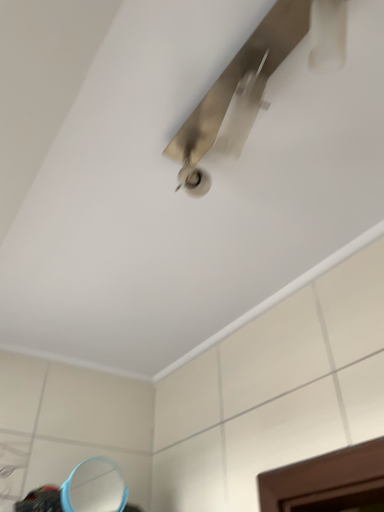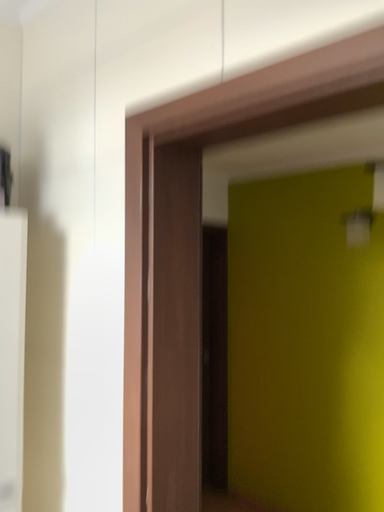
Question: How did the camera likely rotate when shooting the video?

Choices:
 (A) rotated right
 (B) rotated left

Answer: (A)